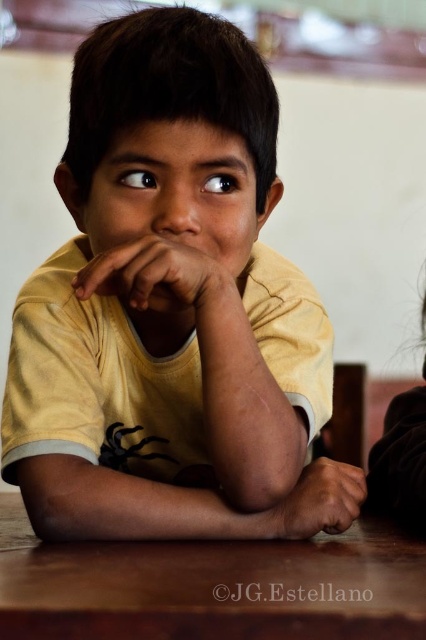
Question: Which point is farther from the camera taking this photo?

Choices:
 (A) (317, 502)
 (B) (106, 259)
 (C) (230, 35)

Answer: (A)

Question: Among these objects, which one is nearest to the camera?

Choices:
 (A) matte yellow shirt at center
 (B) yellow matte shirt at center
 (C) brown polished wood table at lower center
 (D) brown leather hand at center

Answer: (C)

Question: Does yellow matte shirt at center appear over matte yellow shirt at center?

Choices:
 (A) no
 (B) yes

Answer: (B)

Question: Is brown polished wood table at lower center above matte yellow shirt at center?

Choices:
 (A) yes
 (B) no

Answer: (B)

Question: In this image, where is yellow matte shirt at center located relative to brown polished wood table at lower center?

Choices:
 (A) below
 (B) above

Answer: (B)

Question: Based on their relative distances, which object is farther from the brown leather hand at center?

Choices:
 (A) yellow matte shirt at center
 (B) brown polished wood table at lower center
 (C) matte yellow shirt at center

Answer: (C)